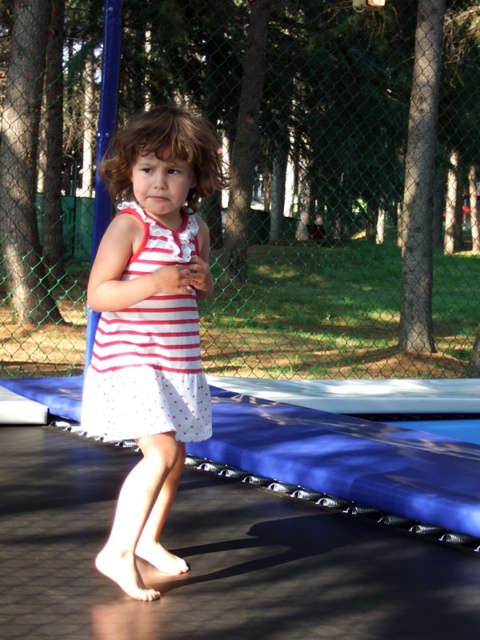
Question: Where is white polka dot dress at center located in relation to white dotted dress at center in the image?

Choices:
 (A) below
 (B) above

Answer: (A)

Question: Can you confirm if white polka dot dress at center is positioned below white dotted dress at center?

Choices:
 (A) no
 (B) yes

Answer: (B)

Question: Does white polka dot dress at center appear under white dotted dress at center?

Choices:
 (A) yes
 (B) no

Answer: (A)

Question: Among these points, which one is nearest to the camera?

Choices:
 (A) (135, 304)
 (B) (96, 310)

Answer: (B)

Question: Among these objects, which one is nearest to the camera?

Choices:
 (A) white dotted dress at center
 (B) white polka dot dress at center

Answer: (B)